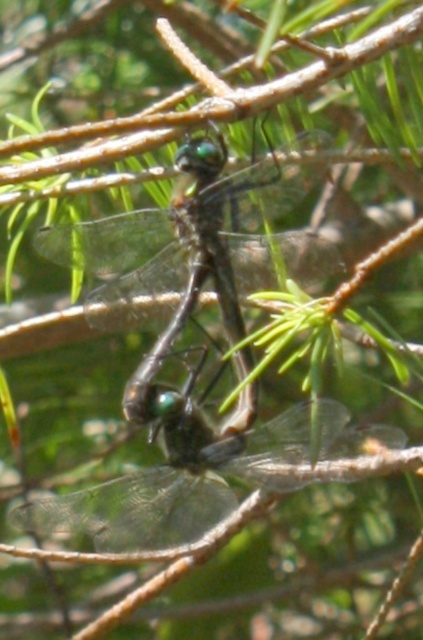
You are an entomologist observing two dragonflies on a branch. You notice the transparent winged dragonfly at center and the transparent glass dragonfly at center. Which one is positioned to the left?

The transparent winged dragonfly at center is positioned to the left of the transparent glass dragonfly at center.

You are a nature photographer trying to capture a closeup of the transparent winged dragonfly at center and the transparent glass dragonfly at center. Which dragonfly is closer to the camera lens?

The transparent winged dragonfly at center is positioned under the transparent glass dragonfly at center, so the transparent glass dragonfly at center is closer to the camera lens.

In the scene shown: You are an entomologist observing two dragonflies on a branch. You notice both the transparent winged dragonfly at center and the transparent glass dragonfly at center. Which one has a bigger body size?

The transparent winged dragonfly at center is larger in size than the transparent glass dragonfly at center, so it has a bigger body size.